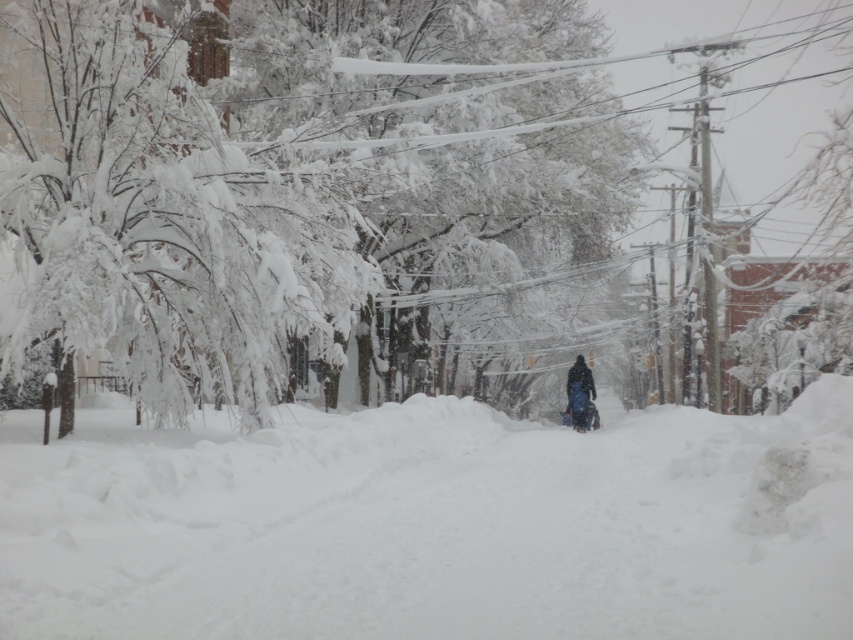
Between point (770, 561) and point (596, 104), which one is positioned behind?

The point (596, 104) is behind.

Who is taller, white fluffy snow at center or white frosty tree at center?

Standing taller between the two is white frosty tree at center.

Describe the element at coordinates (431, 524) in the screenshot. I see `white fluffy snow at center` at that location.

You are a GUI agent. You are given a task and a screenshot of the screen. Output one action in this format:
    pyautogui.click(x=<x>, y=<y>)
    Task: Click on the white fluffy snow at center
    
    Given the screenshot: What is the action you would take?
    pyautogui.click(x=431, y=524)

Is white fluffy snow at center to the right of dark blue fabric at center from the viewer's perspective?

In fact, white fluffy snow at center is to the left of dark blue fabric at center.

Which of these two, white fluffy snow at center or dark blue fabric at center, stands shorter?

Standing shorter between the two is dark blue fabric at center.

Does point (202, 444) come in front of point (584, 422)?

Yes, it is in front of point (584, 422).

Identify the location of white fluffy snow at center. (431, 524).

Which of these two, white frosty tree at center or dark blue fabric at center, stands shorter?

dark blue fabric at center is shorter.

Who is positioned more to the left, white frosty tree at center or dark blue fabric at center?

Positioned to the left is white frosty tree at center.

Is point (202, 132) positioned after point (585, 385)?

No, (202, 132) is in front of (585, 385).

I want to click on white frosty tree at center, so pyautogui.click(x=268, y=173).